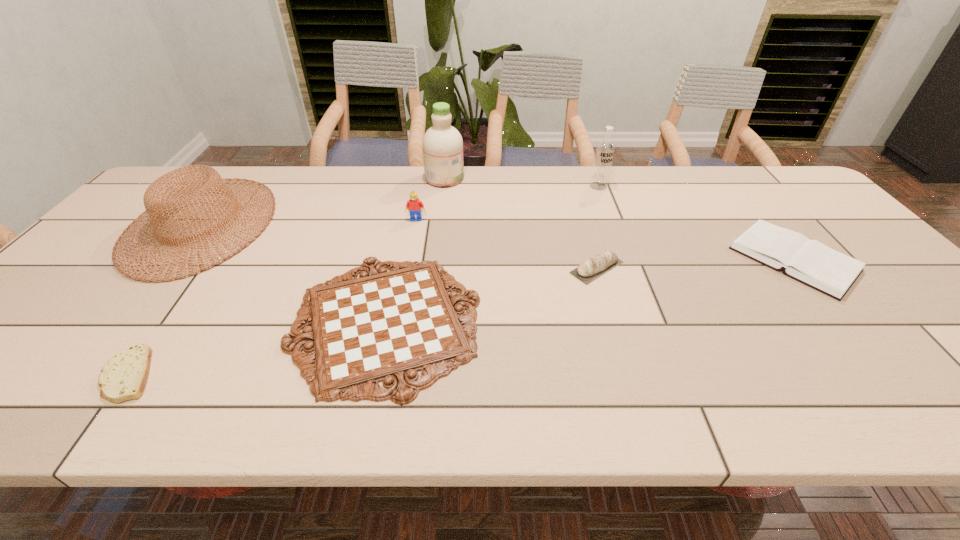
Identify which object is the sixth nearest to the Lego. Please provide its 2D coordinates. Your answer should be formatted as a tuple, i.e. [(x, y)], where the tuple contains the x and y coordinates of a point satisfying the conditions above.

[(124, 376)]

Where is `object that is the fifth closest to the cleansing agent`? object that is the fifth closest to the cleansing agent is located at coordinates (588, 270).

Where is `free location that satisfies the following two spatial constraints: 1. on the front label of the tallest object; 2. on the front side of the chessboard`? This screenshot has height=540, width=960. free location that satisfies the following two spatial constraints: 1. on the front label of the tallest object; 2. on the front side of the chessboard is located at coordinates (427, 321).

What are the coordinates of `blank space that satisfies the following two spatial constraints: 1. on the front label of the rightmost object; 2. on the right side of the cleansing agent` in the screenshot? It's located at (435, 259).

Identify the location of vacant space that satisfies the following two spatial constraints: 1. on the face of the farther pita bread; 2. on the left side of the Lego. The width and height of the screenshot is (960, 540). point(407,267).